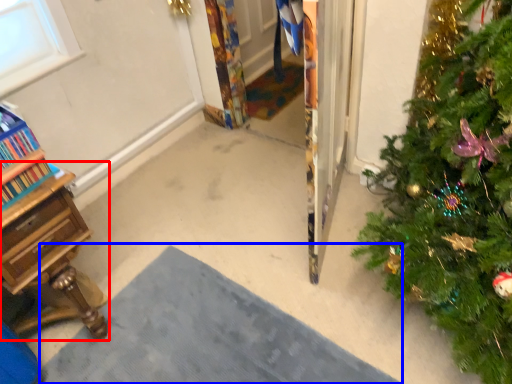
Question: Which object is further to the camera taking this photo, desk (highlighted by a red box) or doormat (highlighted by a blue box)?

Choices:
 (A) desk
 (B) doormat

Answer: (A)